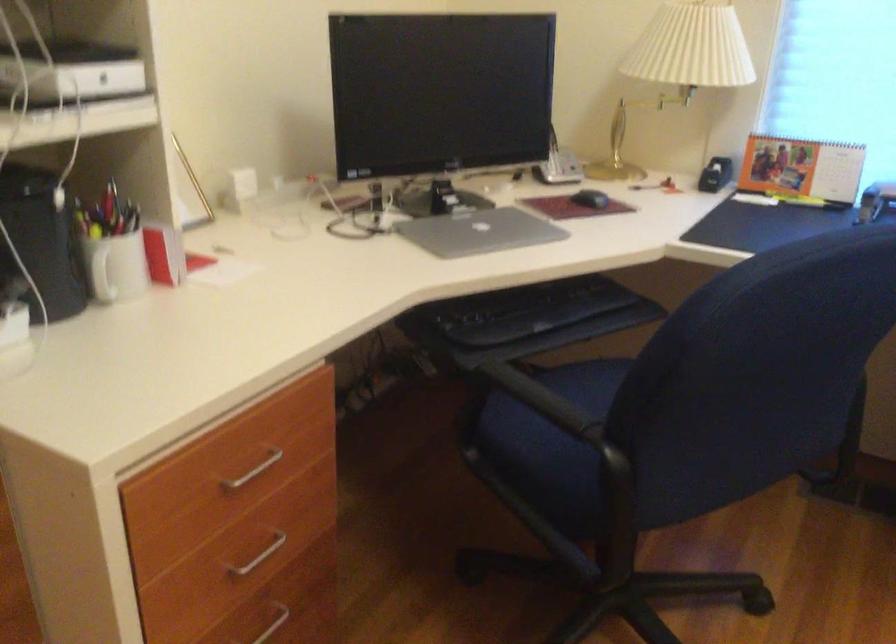
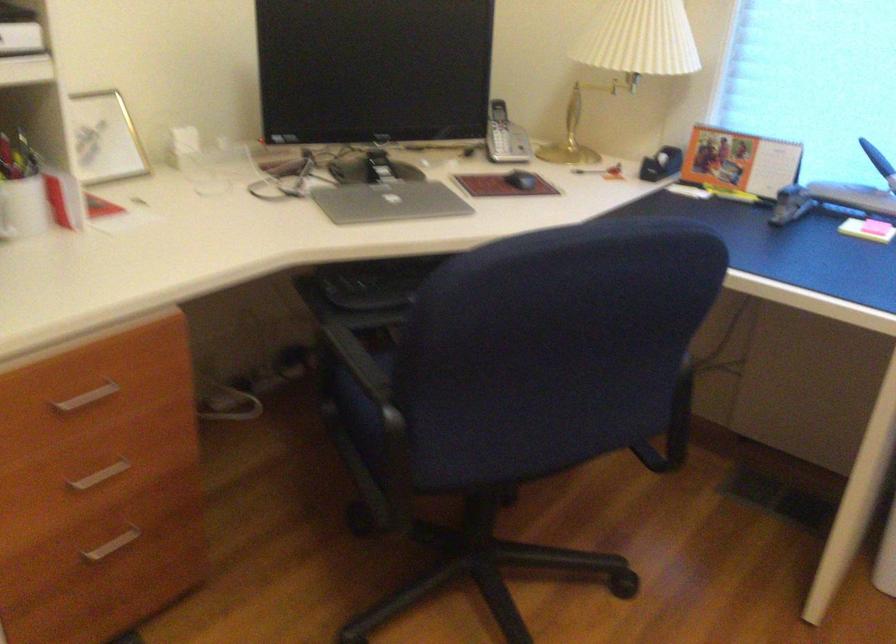
Question: I am providing you with two images of the same scene from different viewpoints. After the viewpoint changes to image2, which objects are now occluded?

Choices:
 (A) small desk calendar
 (B) chair sitting surface
 (C) black computer mouse
 (D) none of these

Answer: (D)